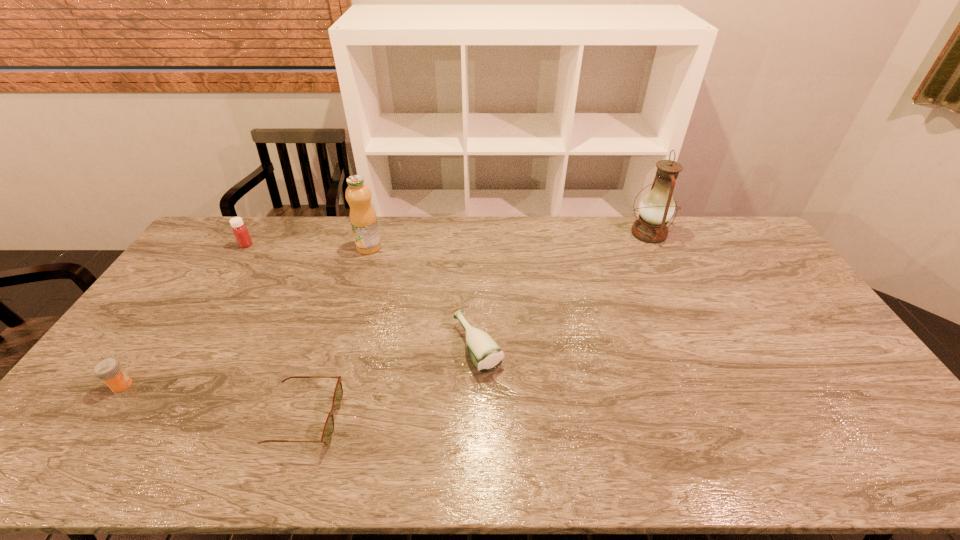
In the image, there is a desktop. Where is `vacant space at the far edge`? The width and height of the screenshot is (960, 540). vacant space at the far edge is located at coordinates (473, 238).

This screenshot has height=540, width=960. I want to click on free space at the near edge of the desktop, so tap(114, 461).

Where is `vacant space at the left edge`? vacant space at the left edge is located at coordinates (170, 358).

Image resolution: width=960 pixels, height=540 pixels. I want to click on vacant space at the right edge of the desktop, so click(762, 275).

This screenshot has width=960, height=540. What are the coordinates of `free region at the near left corner` in the screenshot? It's located at (76, 461).

In the image, there is a desktop. Where is `vacant space at the near right corner`? This screenshot has width=960, height=540. vacant space at the near right corner is located at coordinates (841, 438).

At what (x,y) coordinates should I click in order to perform the action: click on free space between the right medicine and the fruit juice. Please return your answer as a coordinate pair (x, y). Looking at the image, I should click on (307, 246).

Locate an element on the screen. Image resolution: width=960 pixels, height=540 pixels. vacant space that's between the bottle and the taller medicine is located at coordinates (362, 295).

The image size is (960, 540). In order to click on vacant space that's between the bottle and the shortest object in this screenshot , I will do `click(392, 383)`.

The width and height of the screenshot is (960, 540). I want to click on free space between the oil lamp and the bottle, so click(x=564, y=290).